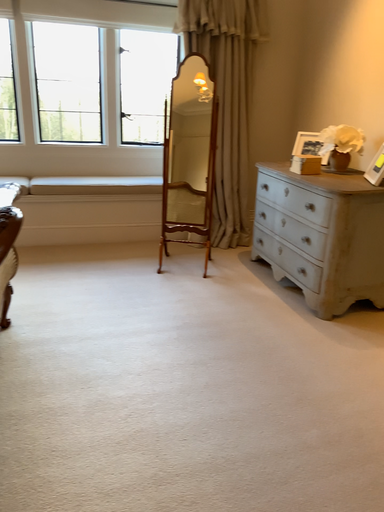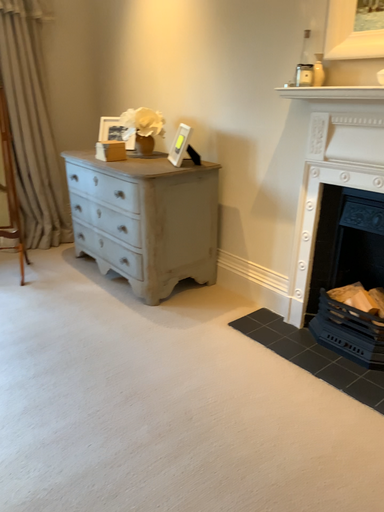
Question: Which way did the camera rotate in the video?

Choices:
 (A) rotated right
 (B) rotated left

Answer: (A)